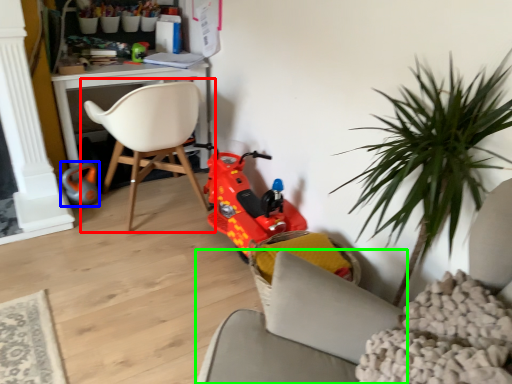
Question: Which is nearer to the chair (highlighted by a red box)? toy (highlighted by a blue box) or chair (highlighted by a green box).

Choices:
 (A) toy
 (B) chair

Answer: (A)